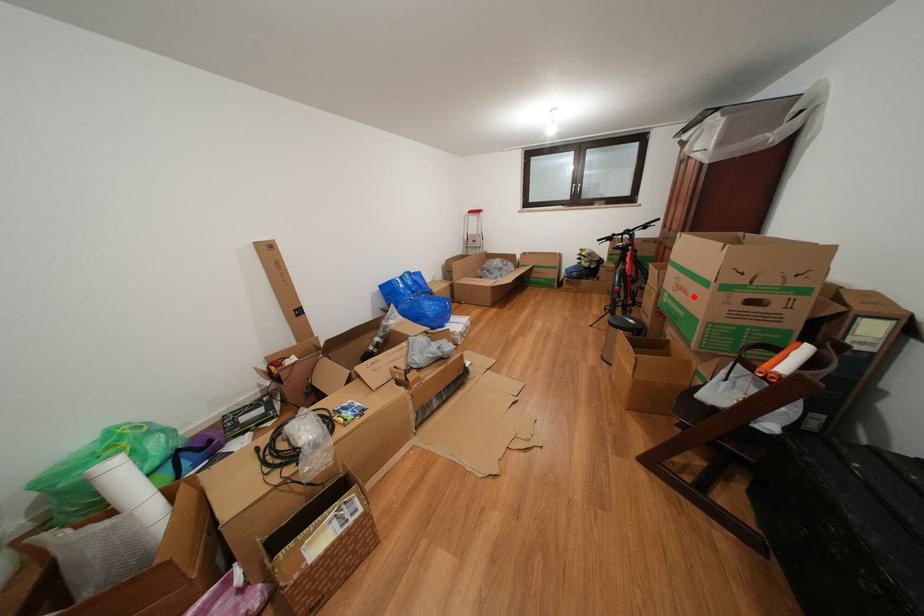
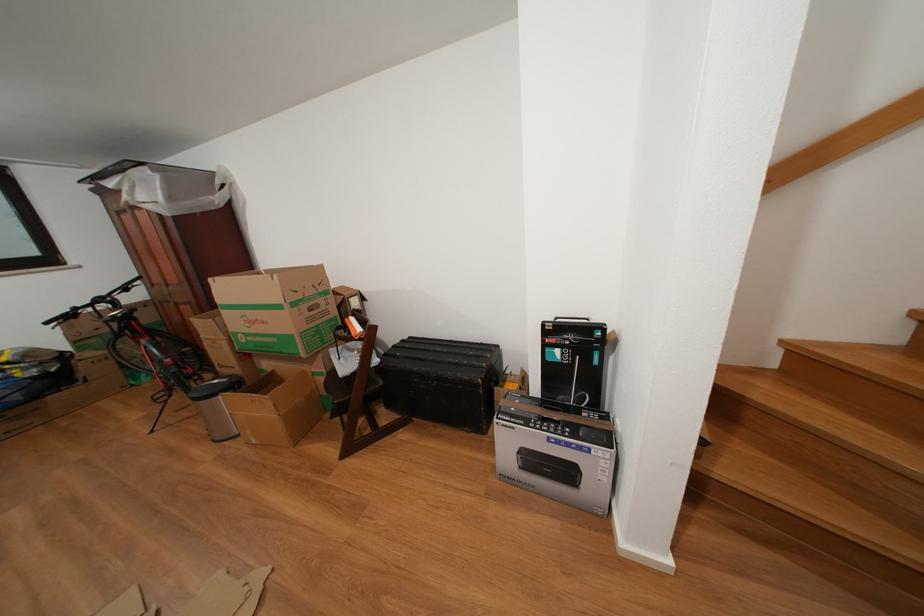
Question: I am providing you with two images of the same scene from different viewpoints. Given a red point in image1, look at the same physical point in image2. Is it:

Choices:
 (A) Closer to the viewpoint
 (B) Farther from the viewpoint

Answer: (B)